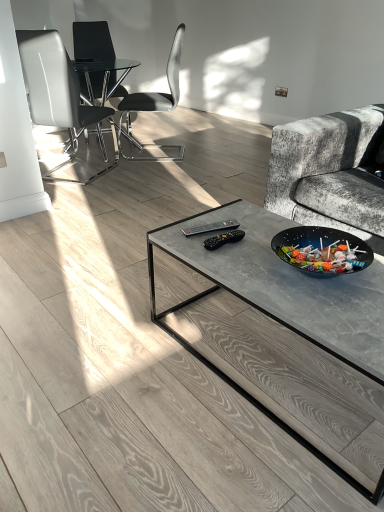
The width and height of the screenshot is (384, 512). What do you see at coordinates (98, 62) in the screenshot? I see `black glass chair at upper left, which is counted as the third chair, starting from the front` at bounding box center [98, 62].

What do you see at coordinates (59, 95) in the screenshot?
I see `white leather chair at left, which is the 3th chair in back-to-front order` at bounding box center [59, 95].

I want to click on black plastic chair at center, which appears as the second chair when viewed from the back, so point(158,101).

Does black glass chair at upper left, which is counted as the third chair, starting from the front, touch white leather chair at left, acting as the first chair starting from the front?

black glass chair at upper left, which is counted as the third chair, starting from the front, is not next to white leather chair at left, acting as the first chair starting from the front, and they're not touching.

What are the coordinates of `the 2nd chair behind the white leather chair at left, acting as the first chair starting from the front` in the screenshot? It's located at (98, 62).

From the image's perspective, who appears lower, black glass chair at upper left, arranged as the first chair when viewed from the back, or white leather chair at left, which is the 3th chair in back-to-front order?

From the image's view, white leather chair at left, which is the 3th chair in back-to-front order, is below.

In the scene shown: Does black glass chair at upper left, which is counted as the third chair, starting from the front, contain white leather chair at left, acting as the first chair starting from the front?

Actually, white leather chair at left, acting as the first chair starting from the front, is outside black glass chair at upper left, which is counted as the third chair, starting from the front.

Based on the photo, is black plastic chair at center, which appears as the second chair when viewed from the back, at the right side of black glass chair at upper left, which is counted as the third chair, starting from the front?

Correct, you'll find black plastic chair at center, which appears as the second chair when viewed from the back, to the right of black glass chair at upper left, which is counted as the third chair, starting from the front.

In the image, there is a black plastic chair at center, which is the second chair from front to back. Identify the location of chair above it (from the image's perspective). This screenshot has height=512, width=384. (98, 62).

Is black plastic chair at center, which appears as the second chair when viewed from the back, bigger or smaller than black glass chair at upper left, which is counted as the third chair, starting from the front?

black plastic chair at center, which appears as the second chair when viewed from the back, is smaller than black glass chair at upper left, which is counted as the third chair, starting from the front.

Is black glass chair at upper left, which is counted as the third chair, starting from the front, inside black plastic chair at center, which appears as the second chair when viewed from the back?

No, black plastic chair at center, which appears as the second chair when viewed from the back, does not contain black glass chair at upper left, which is counted as the third chair, starting from the front.

From the picture: Does white leather chair at left, which is the 3th chair in back-to-front order, contain black glass chair at upper left, which is counted as the third chair, starting from the front?

No, black glass chair at upper left, which is counted as the third chair, starting from the front, is located outside of white leather chair at left, which is the 3th chair in back-to-front order.

From a real-world perspective, relative to black glass chair at upper left, which is counted as the third chair, starting from the front, is white leather chair at left, which is the 3th chair in back-to-front order, vertically above or below?

In terms of real-world spatial position, white leather chair at left, which is the 3th chair in back-to-front order, is above black glass chair at upper left, which is counted as the third chair, starting from the front.

Considering their positions, is white leather chair at left, acting as the first chair starting from the front, located in front of or behind black glass chair at upper left, which is counted as the third chair, starting from the front?

Clearly, white leather chair at left, acting as the first chair starting from the front, is in front of black glass chair at upper left, which is counted as the third chair, starting from the front.

Is white leather chair at left, which is the 3th chair in back-to-front order, beside black glass chair at upper left, which is counted as the third chair, starting from the front?

There is a gap between white leather chair at left, which is the 3th chair in back-to-front order, and black glass chair at upper left, which is counted as the third chair, starting from the front.

In terms of size, does black glass chair at upper left, which is counted as the third chair, starting from the front, appear bigger or smaller than black plastic chair at center, which appears as the second chair when viewed from the back?

Clearly, black glass chair at upper left, which is counted as the third chair, starting from the front, is larger in size than black plastic chair at center, which appears as the second chair when viewed from the back.

Does black glass chair at upper left, which is counted as the third chair, starting from the front, lie behind black plastic chair at center, which is the second chair from front to back?

Yes, black glass chair at upper left, which is counted as the third chair, starting from the front, is behind black plastic chair at center, which is the second chair from front to back.

Are black glass chair at upper left, arranged as the first chair when viewed from the back, and black plastic chair at center, which is the second chair from front to back, making contact?

black glass chair at upper left, arranged as the first chair when viewed from the back, and black plastic chair at center, which is the second chair from front to back, are clearly separated.

Based on the photo, from a real-world perspective, which is physically below, black glass chair at upper left, arranged as the first chair when viewed from the back, or black plastic chair at center, which is the second chair from front to back?

black glass chair at upper left, arranged as the first chair when viewed from the back.

Which object is wider, black plastic chair at center, which is the second chair from front to back, or white leather chair at left, which is the 3th chair in back-to-front order?

Wider between the two is black plastic chair at center, which is the second chair from front to back.

Between point (120, 135) and point (71, 102), which one is positioned in front?

The point (71, 102) is closer.

Between black plastic chair at center, which appears as the second chair when viewed from the back, and white leather chair at left, acting as the first chair starting from the front, which one has less height?

With less height is black plastic chair at center, which appears as the second chair when viewed from the back.

Based on the photo, is white leather chair at left, which is the 3th chair in back-to-front order, oriented towards black plastic chair at center, which is the second chair from front to back?

Yes, white leather chair at left, which is the 3th chair in back-to-front order, is oriented towards black plastic chair at center, which is the second chair from front to back.

Is white leather chair at left, acting as the first chair starting from the front, bigger than black plastic chair at center, which appears as the second chair when viewed from the back?

No, white leather chair at left, acting as the first chair starting from the front, is not bigger than black plastic chair at center, which appears as the second chair when viewed from the back.

From the image's perspective, is white leather chair at left, which is the 3th chair in back-to-front order, below black plastic chair at center, which appears as the second chair when viewed from the back?

Yes.

Is white leather chair at left, which is the 3th chair in back-to-front order, to the left of black plastic chair at center, which is the second chair from front to back, from the viewer's perspective?

Yes.

Find the location of a particular element. chair that is on the left side of black glass chair at upper left, arranged as the first chair when viewed from the back is located at coordinates (59, 95).

Find the location of a particular element. This screenshot has height=512, width=384. the 2nd chair directly beneath the black plastic chair at center, which is the second chair from front to back (from a real-world perspective) is located at coordinates (98, 62).

Considering their positions, is black glass chair at upper left, which is counted as the third chair, starting from the front, positioned further to black plastic chair at center, which is the second chair from front to back, than white leather chair at left, which is the 3th chair in back-to-front order?

white leather chair at left, which is the 3th chair in back-to-front order, is positioned further to the anchor black plastic chair at center, which is the second chair from front to back.

Based on their spatial positions, is white leather chair at left, acting as the first chair starting from the front, or black plastic chair at center, which is the second chair from front to back, closer to black glass chair at upper left, arranged as the first chair when viewed from the back?

The object closer to black glass chair at upper left, arranged as the first chair when viewed from the back, is white leather chair at left, acting as the first chair starting from the front.

When comparing their distances from white leather chair at left, which is the 3th chair in back-to-front order, does black glass chair at upper left, arranged as the first chair when viewed from the back, or black plastic chair at center, which appears as the second chair when viewed from the back, seem closer?

black glass chair at upper left, arranged as the first chair when viewed from the back, is positioned closer to the anchor white leather chair at left, which is the 3th chair in back-to-front order.

Looking at the image, which one is located further to black glass chair at upper left, which is counted as the third chair, starting from the front, black plastic chair at center, which is the second chair from front to back, or white leather chair at left, acting as the first chair starting from the front?

The object further to black glass chair at upper left, which is counted as the third chair, starting from the front, is black plastic chair at center, which is the second chair from front to back.

Based on their spatial positions, is white leather chair at left, which is the 3th chair in back-to-front order, or black glass chair at upper left, arranged as the first chair when viewed from the back, further from black plastic chair at center, which is the second chair from front to back?

The object further to black plastic chair at center, which is the second chair from front to back, is white leather chair at left, which is the 3th chair in back-to-front order.

Which object lies further to the anchor point white leather chair at left, acting as the first chair starting from the front, black plastic chair at center, which is the second chair from front to back, or black glass chair at upper left, which is counted as the third chair, starting from the front?

Among the two, black plastic chair at center, which is the second chair from front to back, is located further to white leather chair at left, acting as the first chair starting from the front.

This screenshot has height=512, width=384. I want to click on chair located between white leather chair at left, acting as the first chair starting from the front, and black glass chair at upper left, arranged as the first chair when viewed from the back, in the depth direction, so click(x=158, y=101).